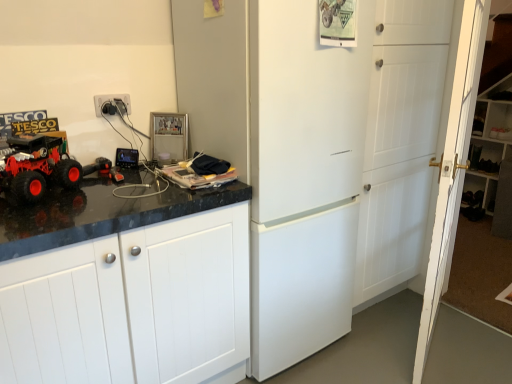
This screenshot has height=384, width=512. Describe the element at coordinates (111, 99) in the screenshot. I see `white plastic electric outlet at upper left` at that location.

Locate an element on the screen. white plastic electric outlet at upper left is located at coordinates (111, 99).

The width and height of the screenshot is (512, 384). In order to click on metallic silver frame at upper center in this screenshot , I will do `click(168, 137)`.

Measure the distance between point [29,300] and camera.

The depth of point [29,300] is 1.22 meters.

Measure the distance between white matte cabinet at left and camera.

A distance of 3.75 feet exists between white matte cabinet at left and camera.

Describe the element at coordinates (452, 169) in the screenshot. I see `white wooden door at right, the 2th door in the left-to-right sequence` at that location.

The height and width of the screenshot is (384, 512). What do you see at coordinates (400, 143) in the screenshot?
I see `white matte door at center, which appears as the 1th door when viewed from the left` at bounding box center [400, 143].

The width and height of the screenshot is (512, 384). In order to click on white plastic electric outlet at upper left in this screenshot , I will do `click(111, 99)`.

Is white wooden door at right, marked as the first door in a right-to-left arrangement, not near white matte refrigerator at center?

That's not correct — white wooden door at right, marked as the first door in a right-to-left arrangement, is a little close to white matte refrigerator at center.

Consider the image. Is white wooden door at right, marked as the first door in a right-to-left arrangement, to the left or to the right of white matte refrigerator at center in the image?

In the image, white wooden door at right, marked as the first door in a right-to-left arrangement, appears on the right side of white matte refrigerator at center.

Considering the relative sizes of white wooden door at right, the 2th door in the left-to-right sequence, and white matte refrigerator at center in the image provided, is white wooden door at right, the 2th door in the left-to-right sequence, smaller than white matte refrigerator at center?

Yes, white wooden door at right, the 2th door in the left-to-right sequence, is smaller than white matte refrigerator at center.

In the image, is white wooden door at right, marked as the first door in a right-to-left arrangement, positioned in front of or behind white matte refrigerator at center?

white wooden door at right, marked as the first door in a right-to-left arrangement, is positioned closer to the viewer than white matte refrigerator at center.

What's the angular difference between white matte cabinet at left and rubberized red truck at left's facing directions?

39.7 degrees separate the facing orientations of white matte cabinet at left and rubberized red truck at left.

Measure the distance between white matte cabinet at left and rubberized red truck at left.

A distance of 20.30 inches exists between white matte cabinet at left and rubberized red truck at left.

In the scene shown: Which object is more forward, white matte cabinet at left or rubberized red truck at left?

Positioned in front is white matte cabinet at left.

Between point (135, 320) and point (64, 177), which one is positioned in front?

The point (135, 320) is more forward.

Is white plastic electric outlet at upper left closer to camera compared to white matte cabinet at left?

That is False.

From a real-world perspective, which is physically above, white plastic electric outlet at upper left or white matte cabinet at left?

white plastic electric outlet at upper left.

Is point (129, 100) closer to camera compared to point (240, 237)?

That is False.

Consider the image. Can you confirm if rubberized red truck at left is taller than metallic silver frame at upper center?

No.

Where is `appliance behind the rubberized red truck at left`? The image size is (512, 384). appliance behind the rubberized red truck at left is located at coordinates (168, 137).

Based on the photo, from a real-world perspective, is rubberized red truck at left on metallic silver frame at upper center?

No, from a real-world perspective, rubberized red truck at left is not above metallic silver frame at upper center.

Can you confirm if rubberized red truck at left is thinner than metallic silver frame at upper center?

No.

Is white plastic electric outlet at upper left surrounding white matte refrigerator at center?

No, white matte refrigerator at center is not a part of white plastic electric outlet at upper left.

Who is smaller, white plastic electric outlet at upper left or white matte refrigerator at center?

white plastic electric outlet at upper left.

Between white plastic electric outlet at upper left and white matte refrigerator at center, which one has more height?

Standing taller between the two is white matte refrigerator at center.

From a real-world perspective, is metallic silver frame at upper center on top of white plastic electric outlet at upper left?

Incorrect, from a real-world perspective, metallic silver frame at upper center is lower than white plastic electric outlet at upper left.

Is metallic silver frame at upper center to the left of white plastic electric outlet at upper left from the viewer's perspective?

In fact, metallic silver frame at upper center is to the right of white plastic electric outlet at upper left.

From the picture: Looking at the image, does metallic silver frame at upper center seem bigger or smaller compared to white plastic electric outlet at upper left?

metallic silver frame at upper center is bigger than white plastic electric outlet at upper left.

Does metallic silver frame at upper center come behind white plastic electric outlet at upper left?

Yes, metallic silver frame at upper center is further from the viewer.

Does white plastic electric outlet at upper left turn towards rubberized red truck at left?

No, white plastic electric outlet at upper left is not oriented towards rubberized red truck at left.

Is white plastic electric outlet at upper left bigger than rubberized red truck at left?

No, white plastic electric outlet at upper left is not bigger than rubberized red truck at left.

How different are the orientations of white plastic electric outlet at upper left and rubberized red truck at left in degrees?

white plastic electric outlet at upper left and rubberized red truck at left are facing 39.7 degrees away from each other.

Find the location of a particular element. land vehicle below the white plastic electric outlet at upper left (from a real-world perspective) is located at coordinates (37, 167).

Image resolution: width=512 pixels, height=384 pixels. I want to click on refrigerator located behind the white wooden door at right, the 2th door in the left-to-right sequence, so click(x=307, y=154).

Find the location of a particular element. This screenshot has height=384, width=512. land vehicle located on the left of white matte cabinet at left is located at coordinates (37, 167).

Based on their spatial positions, is white matte door at center, the 2th door when ordered from right to left, or white matte cabinet at left closer to white plastic electric outlet at upper left?

The object closer to white plastic electric outlet at upper left is white matte cabinet at left.

Which object lies further to the anchor point white matte refrigerator at center, white matte door at center, the 2th door when ordered from right to left, or metallic silver frame at upper center?

Among the two, metallic silver frame at upper center is located further to white matte refrigerator at center.

Estimate the real-world distances between objects in this image. Which object is closer to white wooden door at right, the 2th door in the left-to-right sequence, white matte cabinet at left or rubberized red truck at left?

white matte cabinet at left lies closer to white wooden door at right, the 2th door in the left-to-right sequence, than the other object.

Based on their spatial positions, is rubberized red truck at left or metallic silver frame at upper center closer to white wooden door at right, marked as the first door in a right-to-left arrangement?

Among the two, metallic silver frame at upper center is located nearer to white wooden door at right, marked as the first door in a right-to-left arrangement.

Estimate the real-world distances between objects in this image. Which object is closer to metallic silver frame at upper center, white matte refrigerator at center or white plastic electric outlet at upper left?

The object closer to metallic silver frame at upper center is white plastic electric outlet at upper left.

Considering their positions, is metallic silver frame at upper center positioned further to rubberized red truck at left than white matte door at center, which appears as the 1th door when viewed from the left?

white matte door at center, which appears as the 1th door when viewed from the left, lies further to rubberized red truck at left than the other object.

Based on their spatial positions, is metallic silver frame at upper center or white plastic electric outlet at upper left further from white matte refrigerator at center?

white plastic electric outlet at upper left.

Based on their spatial positions, is white wooden door at right, marked as the first door in a right-to-left arrangement, or metallic silver frame at upper center further from white plastic electric outlet at upper left?

white wooden door at right, marked as the first door in a right-to-left arrangement.

This screenshot has height=384, width=512. I want to click on electric outlet positioned between rubberized red truck at left and metallic silver frame at upper center from near to far, so click(111, 99).

Identify the location of appliance between white plastic electric outlet at upper left and white matte door at center, which appears as the 1th door when viewed from the left, in the horizontal direction. The image size is (512, 384). (168, 137).

Locate an element on the screen. This screenshot has height=384, width=512. refrigerator between white matte cabinet at left and white matte door at center, which appears as the 1th door when viewed from the left is located at coordinates (307, 154).

I want to click on door between metallic silver frame at upper center and white wooden door at right, marked as the first door in a right-to-left arrangement, from left to right, so click(400, 143).